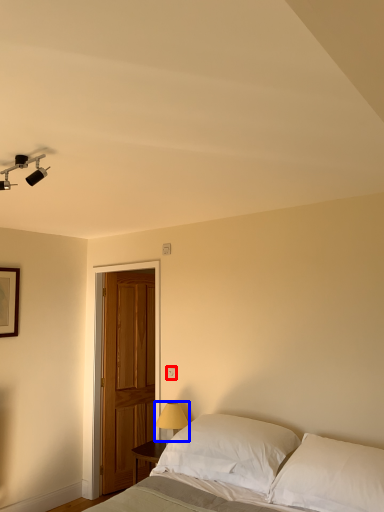
Question: Which point is further to the camera, electric outlet (highlighted by a red box) or table lamp (highlighted by a blue box)?

Choices:
 (A) electric outlet
 (B) table lamp

Answer: (A)